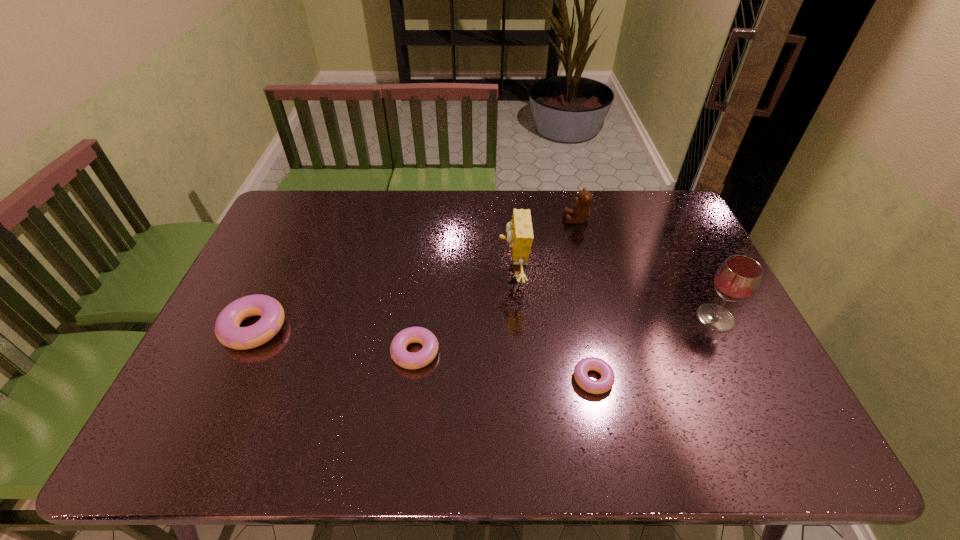
Image resolution: width=960 pixels, height=540 pixels. What are the coordinates of `object at the far edge` in the screenshot? It's located at (581, 211).

Locate an element on the screen. This screenshot has width=960, height=540. object that is positioned at the near edge is located at coordinates (605, 383).

Find the location of a particular element. This screenshot has width=960, height=540. object positioned at the left edge is located at coordinates (227, 330).

Find the location of `object that is at the right edge`. object that is at the right edge is located at coordinates (738, 278).

Find the location of a particular element. The image size is (960, 540). free point at the far edge is located at coordinates (416, 206).

This screenshot has height=540, width=960. In the image, there is a desktop. Find the location of `vacant space at the near edge`. vacant space at the near edge is located at coordinates (650, 399).

In the image, there is a desktop. At what (x,y) coordinates should I click in order to perform the action: click on vacant area at the left edge. Please return your answer as a coordinate pair (x, y). The image size is (960, 540). Looking at the image, I should click on (291, 278).

Find the location of `vacant space at the right edge of the desktop`. vacant space at the right edge of the desktop is located at coordinates (750, 376).

The height and width of the screenshot is (540, 960). I want to click on vacant space at the far right corner, so click(650, 221).

In the image, there is a desktop. Where is `vacant space at the near right corner`? vacant space at the near right corner is located at coordinates [761, 393].